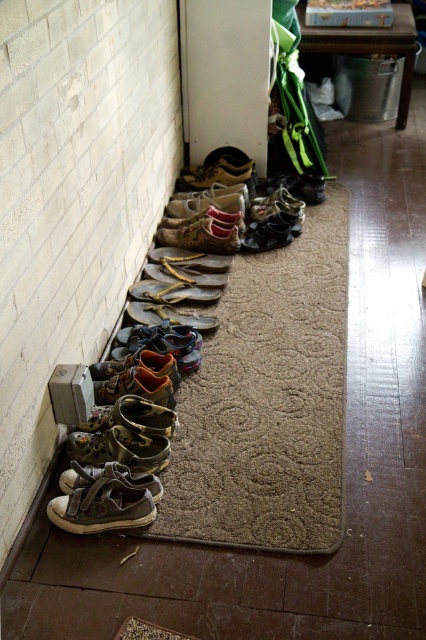
Question: Estimate the real-world distances between objects in this image. Which object is farther from the brown textured doormat at lower left?

Choices:
 (A) leather sandal at lower left
 (B) brown leather shoe at lower center
 (C) leather brown shoe at lower left
 (D) brown suede sandal at center

Answer: (A)

Question: Does brown leather shoe at lower center have a smaller size compared to matte black shoe at center?

Choices:
 (A) yes
 (B) no

Answer: (B)

Question: Which object is closer to the camera taking this photo?

Choices:
 (A) leather sandal at lower left
 (B) leather shoe at lower left
 (C) matte black shoe at center
 (D) brown leather shoe at lower center

Answer: (A)

Question: Does leather/canvas sneaker at lower left appear on the left side of brown leather sandal at center?

Choices:
 (A) yes
 (B) no

Answer: (A)

Question: Is brown suede shoe at lower center positioned at the back of brown leather shoe at lower center?

Choices:
 (A) no
 (B) yes

Answer: (B)

Question: Estimate the real-world distances between objects in this image. Which object is closer to the leather sandal at lower left?

Choices:
 (A) matte black shoe at center
 (B) leather shoe at lower left

Answer: (B)